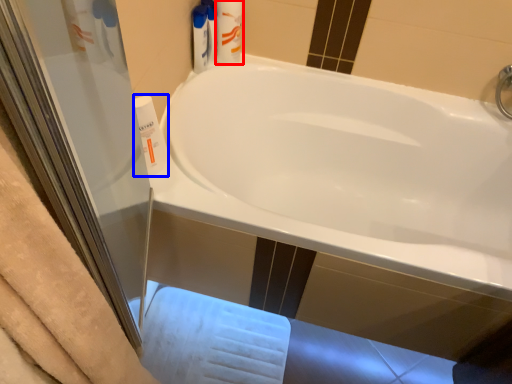
Question: Among these objects, which one is farthest to the camera, toiletry (highlighted by a red box) or cleaning product (highlighted by a blue box)?

Choices:
 (A) toiletry
 (B) cleaning product

Answer: (A)